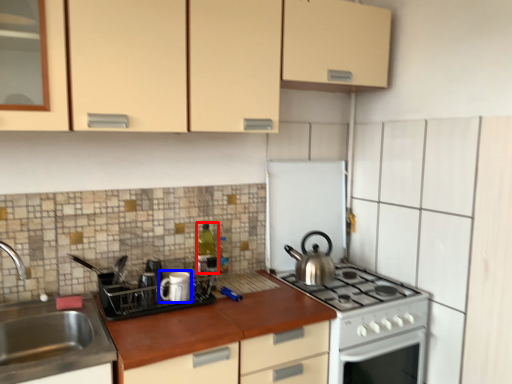
Question: Which object appears closest to the camera in this image, bottle (highlighted by a red box) or appliance (highlighted by a blue box)?

Choices:
 (A) bottle
 (B) appliance

Answer: (B)